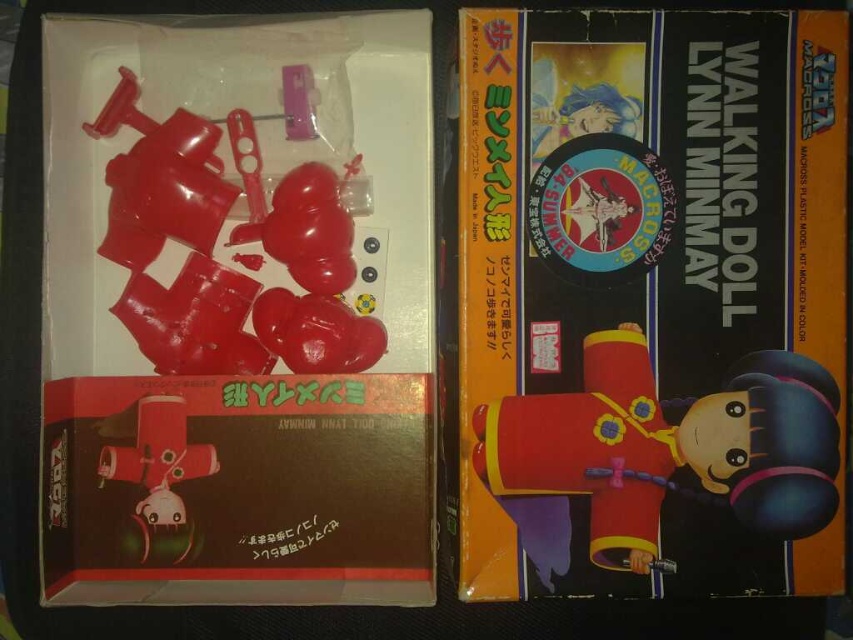
Question: Which of these objects is positioned farthest from the matte plastic parts at center?

Choices:
 (A) matte red plastic at center
 (B) matte red plastic walking doll at center
 (C) matte plastic box at center
 (D) matte red plastic walking doll at lower left

Answer: (B)

Question: Which of the following is the closest to the observer?

Choices:
 (A) (323, 280)
 (B) (144, 440)

Answer: (B)

Question: Which point is closer to the camera taking this photo?

Choices:
 (A) (646, 378)
 (B) (140, 406)
 (C) (344, 285)
 (D) (106, 44)

Answer: (A)

Question: Is matte red plastic walking doll at center to the right of matte red plastic walking doll at lower left from the viewer's perspective?

Choices:
 (A) yes
 (B) no

Answer: (A)

Question: Is matte plastic parts at center to the left of matte red plastic at center from the viewer's perspective?

Choices:
 (A) no
 (B) yes

Answer: (B)

Question: Does matte plastic parts at center appear on the left side of matte red plastic walking doll at center?

Choices:
 (A) yes
 (B) no

Answer: (A)